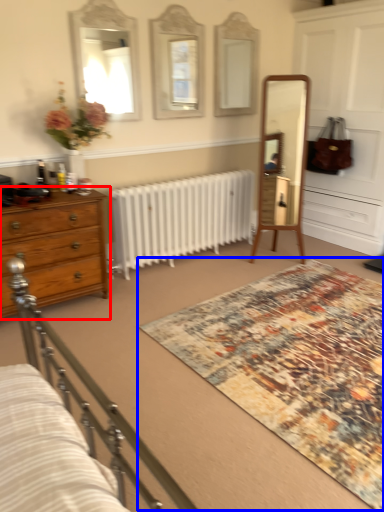
Question: Which object is closer to the camera taking this photo, chest of drawers (highlighted by a red box) or mat (highlighted by a blue box)?

Choices:
 (A) chest of drawers
 (B) mat

Answer: (B)